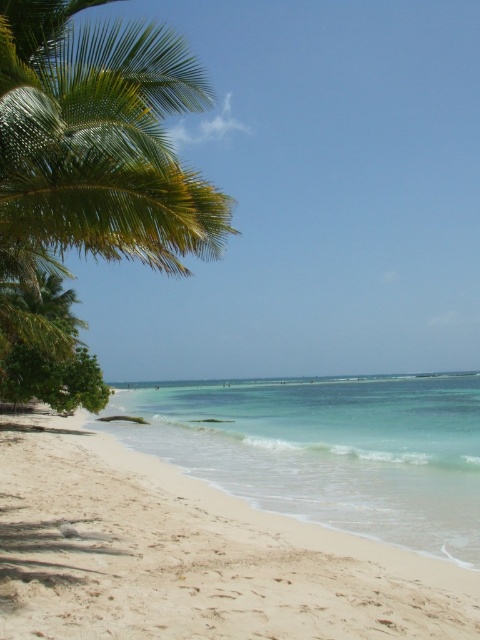
Question: Does white sandy beach at lower left appear under green leafy palm tree at left?

Choices:
 (A) yes
 (B) no

Answer: (A)

Question: Can you confirm if white sandy beach at lower left is positioned above green leafy palm tree at left?

Choices:
 (A) yes
 (B) no

Answer: (B)

Question: Which object is the closest to the green leafy palm tree at left?

Choices:
 (A) white sandy beach at lower left
 (B) clear blue water at center

Answer: (A)

Question: Considering the real-world distances, which object is closest to the white sandy beach at lower left?

Choices:
 (A) green leafy palm tree at left
 (B) clear blue water at center

Answer: (A)

Question: Does green leafy palm tree at left appear under clear blue water at center?

Choices:
 (A) yes
 (B) no

Answer: (B)

Question: Which object is farther from the camera taking this photo?

Choices:
 (A) green leafy palm tree at left
 (B) clear blue water at center

Answer: (B)